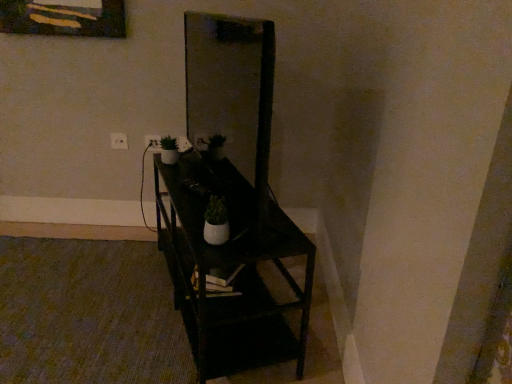
This screenshot has width=512, height=384. I want to click on blank space situated above black matte shelf at center (from a real-world perspective), so click(x=202, y=178).